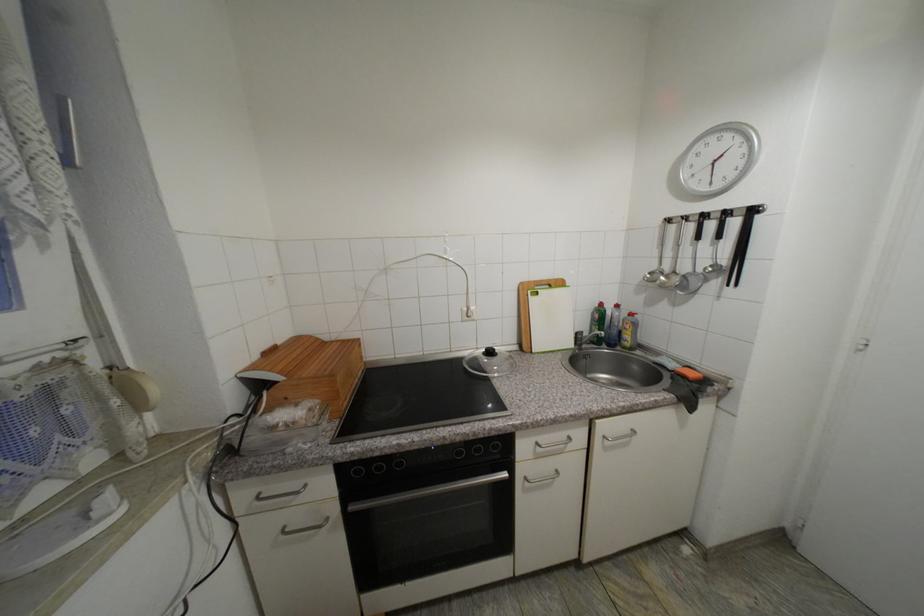
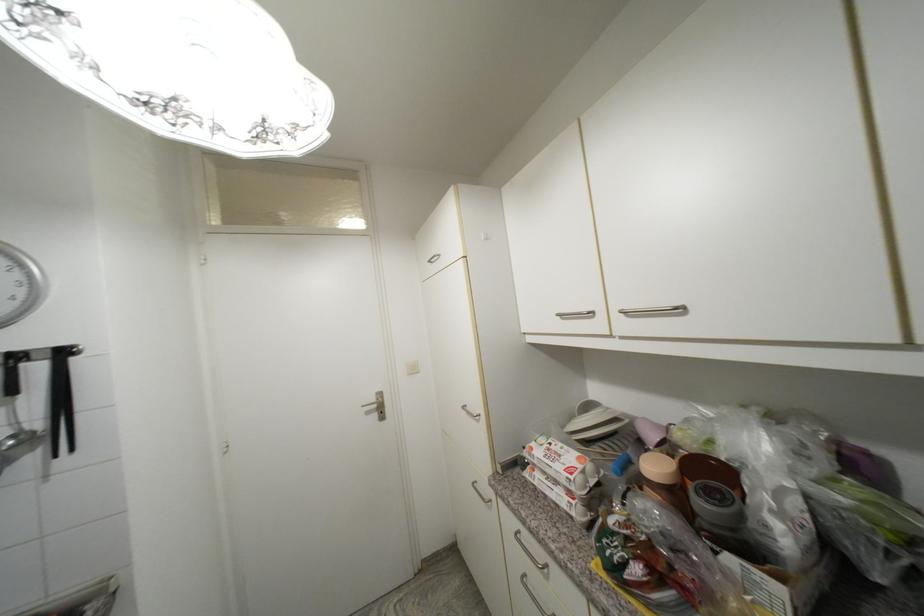
In the second image, find the point that corresponds to point (759, 213) in the first image.

(69, 354)